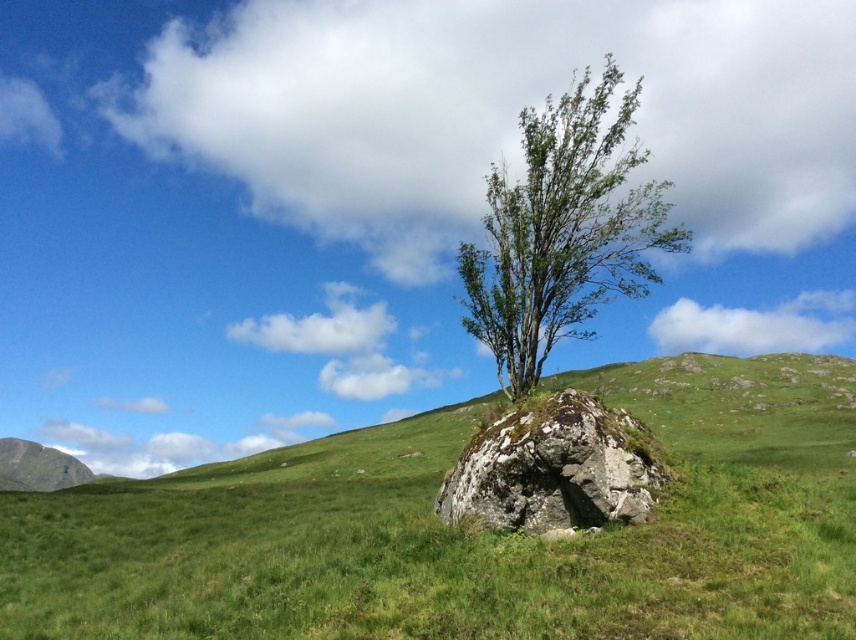
You are planning to place a small garden bench in the image. The bench requires a flat area wider than the mossy rock at center. Can the green grass at center provide a suitable location for the bench?

The green grass at center might be wider than mossy rock at center, so it could potentially provide a suitable flat area for the bench if the width is sufficient.

You are standing at the center of the field and want to walk towards the solitary tree on the rock. According to the coordinates provided, is the green grass at center directly in your path to the tree?

The green grass at center is located at point (x=468, y=529), which suggests it is positioned near the center of the field. Since you are already standing at the center, the green grass at center is directly under your feet and therefore in your path as you move toward the tree on the rock.